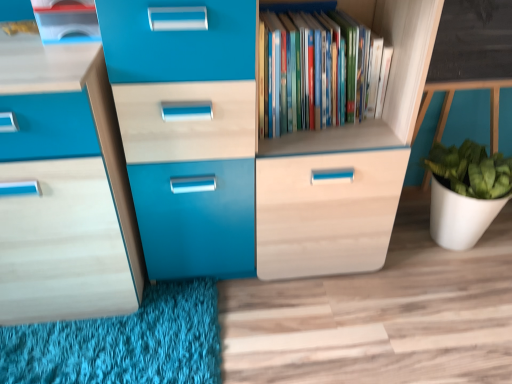
Locate an element on the screen. The image size is (512, 384). matte plastic container at upper left is located at coordinates (66, 20).

What do you see at coordinates (66, 20) in the screenshot? Image resolution: width=512 pixels, height=384 pixels. I see `matte plastic container at upper left` at bounding box center [66, 20].

This screenshot has width=512, height=384. Describe the element at coordinates (388, 79) in the screenshot. I see `wooden bookshelf at center` at that location.

What is the approximate width of wooden bookshelf at center?

The width of wooden bookshelf at center is 5.35 inches.

Find the location of a particular element. This screenshot has width=512, height=384. wooden bookshelf at center is located at coordinates (388, 79).

At what (x,y) coordinates should I click in order to perform the action: click on matte plastic container at upper left. Please return your answer as a coordinate pair (x, y). Looking at the image, I should click on (66, 20).

Between wooden bookshelf at center and matte plastic container at upper left, which one appears on the right side from the viewer's perspective?

Positioned to the right is wooden bookshelf at center.

Who is more distant, wooden bookshelf at center or matte plastic container at upper left?

wooden bookshelf at center is more distant.

Does point (390, 114) appear closer or farther from the camera than point (80, 28)?

Point (390, 114).

From the image's perspective, is wooden bookshelf at center under matte plastic container at upper left?

Indeed, from the image's perspective, wooden bookshelf at center is shown beneath matte plastic container at upper left.

From the picture: From a real-world perspective, between wooden bookshelf at center and matte plastic container at upper left, who is vertically higher?

matte plastic container at upper left is physically above.

Considering the relative sizes of wooden bookshelf at center and matte plastic container at upper left in the image provided, is wooden bookshelf at center thinner than matte plastic container at upper left?

Yes, wooden bookshelf at center is thinner than matte plastic container at upper left.

Is wooden bookshelf at center shorter than matte plastic container at upper left?

No.

Who is smaller, wooden bookshelf at center or matte plastic container at upper left?

Smaller between the two is matte plastic container at upper left.

Is wooden bookshelf at center located outside matte plastic container at upper left?

Absolutely, wooden bookshelf at center is external to matte plastic container at upper left.

Is wooden bookshelf at center positioned far away from matte plastic container at upper left?

No, wooden bookshelf at center is not far away from matte plastic container at upper left.

Is wooden bookshelf at center facing away from matte plastic container at upper left?

wooden bookshelf at center does not have its back to matte plastic container at upper left.

How far apart are wooden bookshelf at center and matte plastic container at upper left?

wooden bookshelf at center is 28.44 inches from matte plastic container at upper left.

The height and width of the screenshot is (384, 512). In the image, there is a matte plastic container at upper left. Find the location of `shelf below it (from the image's perspective)`. shelf below it (from the image's perspective) is located at coordinates pyautogui.click(x=388, y=79).

Considering the relative positions of matte plastic container at upper left and wooden bookshelf at center in the image provided, is matte plastic container at upper left to the left of wooden bookshelf at center from the viewer's perspective?

Yes, matte plastic container at upper left is to the left of wooden bookshelf at center.

Is matte plastic container at upper left further to the viewer compared to wooden bookshelf at center?

No, it is in front of wooden bookshelf at center.

Between point (65, 29) and point (278, 152), which one is positioned behind?

The point (278, 152) is behind.

From the image's perspective, does matte plastic container at upper left appear lower than wooden bookshelf at center?

No.

From a real-world perspective, between matte plastic container at upper left and wooden bookshelf at center, who is vertically lower?

wooden bookshelf at center, from a real-world perspective.

Considering the relative sizes of matte plastic container at upper left and wooden bookshelf at center in the image provided, is matte plastic container at upper left wider than wooden bookshelf at center?

Yes.

In terms of height, does matte plastic container at upper left look taller or shorter compared to wooden bookshelf at center?

Clearly, matte plastic container at upper left is shorter compared to wooden bookshelf at center.

From the picture: Between matte plastic container at upper left and wooden bookshelf at center, which one has larger size?

wooden bookshelf at center is bigger.

Choose the correct answer: Is matte plastic container at upper left inside wooden bookshelf at center or outside it?

matte plastic container at upper left is located beyond the bounds of wooden bookshelf at center.

Is matte plastic container at upper left placed right next to wooden bookshelf at center?

There is a gap between matte plastic container at upper left and wooden bookshelf at center.

Does matte plastic container at upper left turn towards wooden bookshelf at center?

No, matte plastic container at upper left is not aimed at wooden bookshelf at center.

Measure the distance between matte plastic container at upper left and wooden bookshelf at center.

28.44 inches.

Identify the location of shelf that appears below the matte plastic container at upper left (from the image's perspective). This screenshot has width=512, height=384. (388, 79).

Where is `cabinetry that appears above the wooden bookshelf at center (from a real-world perspective)`? This screenshot has height=384, width=512. cabinetry that appears above the wooden bookshelf at center (from a real-world perspective) is located at coordinates (66, 20).

You are a GUI agent. You are given a task and a screenshot of the screen. Output one action in this format:
    pyautogui.click(x=<x>, y=<y>)
    Task: Click on the shelf on the right of matte plastic container at upper left
    This screenshot has height=384, width=512.
    Given the screenshot: What is the action you would take?
    pyautogui.click(x=388, y=79)